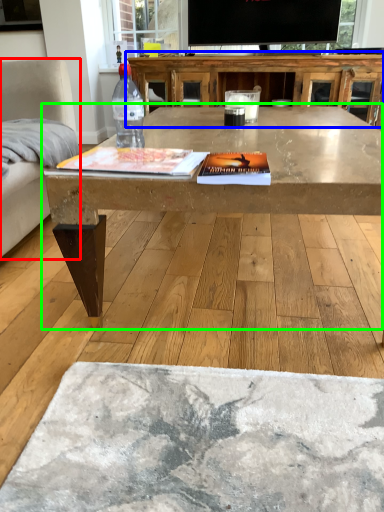
Question: Which is farther away from armchair (highlighted by a red box)? table (highlighted by a blue box) or coffee table (highlighted by a green box)?

Choices:
 (A) table
 (B) coffee table

Answer: (A)